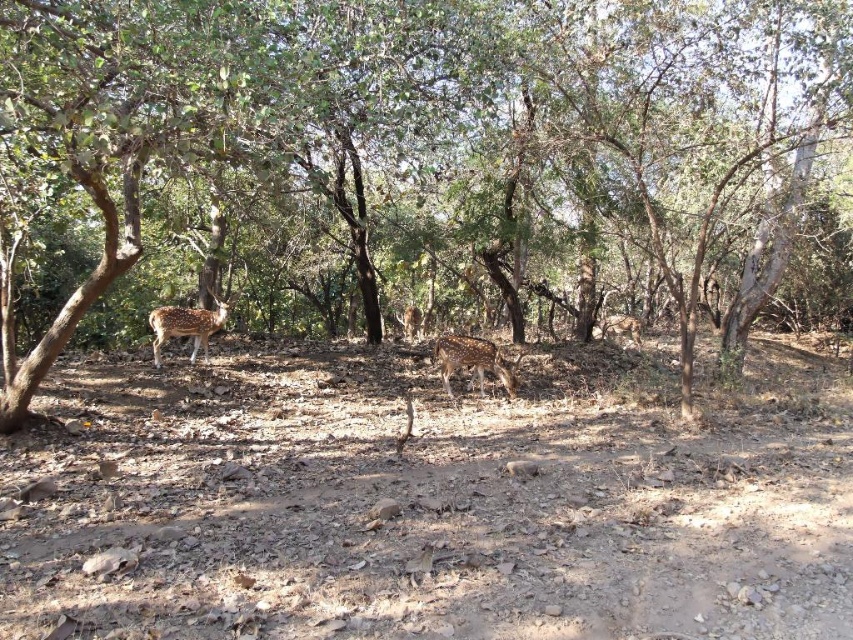
You are a hiker in the forest and see the brown textured tree at center and the spotted fur deer at left. Which object is located to the left of the other?

The spotted fur deer at left is located to the left of the brown textured tree at center.

You are a hiker in the forest and see two spotted fur deer. One is the spotted fur deer at center and the other is the spotted fur deer at left. Which deer is positioned more to the right side of the scene?

The spotted fur deer at center is positioned more to the right side of the scene compared to the spotted fur deer at left.

Looking at this image, you are a hiker trying to spot wildlife in the forest. You see the brown textured tree at center and the spotted fur deer at left. Which object is closer to you?

The brown textured tree at center is closer to you because it is positioned in front of the spotted fur deer at left.